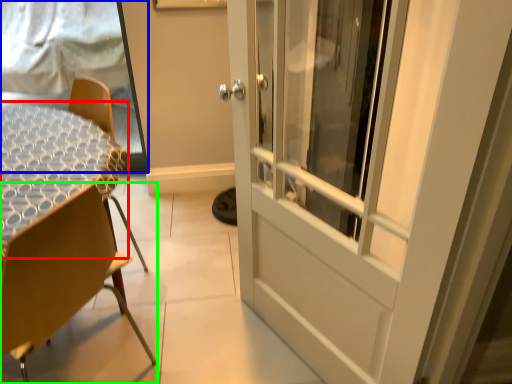
Question: Which object is positioned farthest from round table (highlighted by a red box)? Select from window screen (highlighted by a blue box) and chair (highlighted by a green box).

Choices:
 (A) window screen
 (B) chair

Answer: (A)